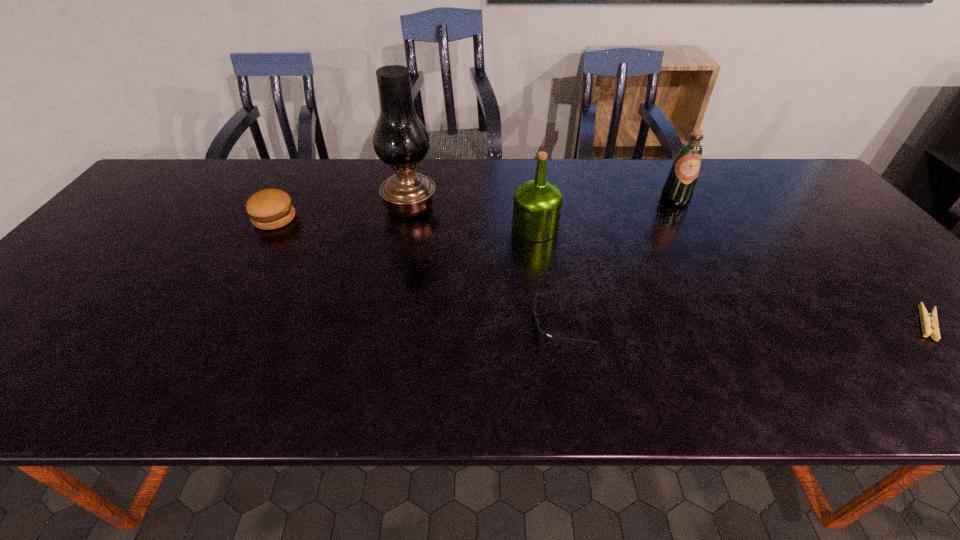
Where is `free spot located on the front-facing side of the second object from right to left`? free spot located on the front-facing side of the second object from right to left is located at coordinates (687, 223).

Where is `free space located on the front of the fourth tallest object`? free space located on the front of the fourth tallest object is located at coordinates (245, 272).

At what (x,y) coordinates should I click in order to perform the action: click on vacant space positioned 0.130m on the front-facing side of the second shortest object. Please return your answer as a coordinate pair (x, y). This screenshot has height=540, width=960. Looking at the image, I should click on (472, 322).

Where is `blank space located on the front-facing side of the second shortest object`? The width and height of the screenshot is (960, 540). blank space located on the front-facing side of the second shortest object is located at coordinates (403, 322).

I want to click on vacant point located 0.200m on the front-facing side of the second shortest object, so click(x=440, y=322).

Find the location of a particular element. Image resolution: width=960 pixels, height=540 pixels. oil lamp that is positioned at the far edge is located at coordinates tap(400, 139).

The image size is (960, 540). In order to click on olive oil that is at the far edge in this screenshot , I will do `click(678, 189)`.

Locate an element on the screen. The width and height of the screenshot is (960, 540). free region at the far edge is located at coordinates (385, 168).

I want to click on vacant area at the near edge of the desktop, so click(59, 378).

Identify the location of free space at the left edge. (172, 202).